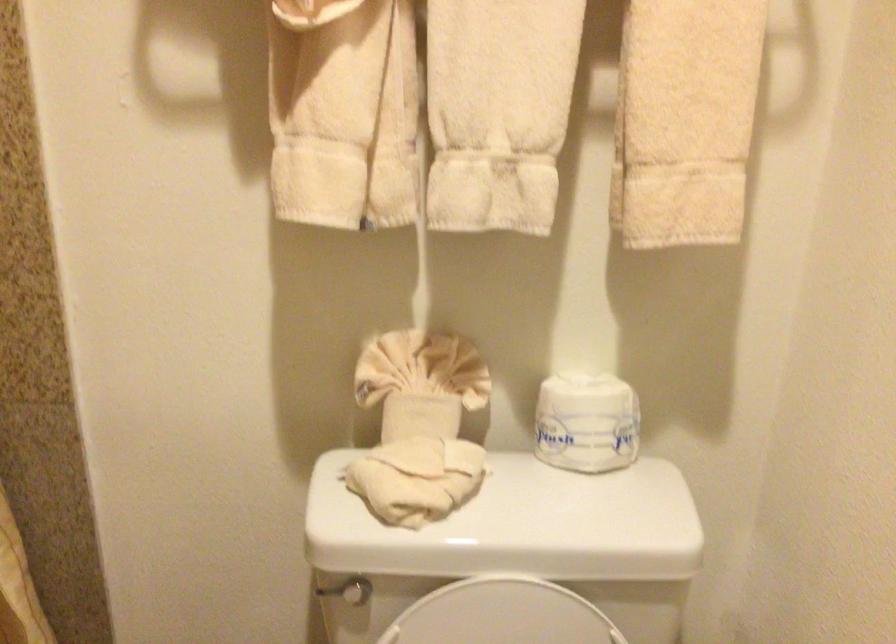
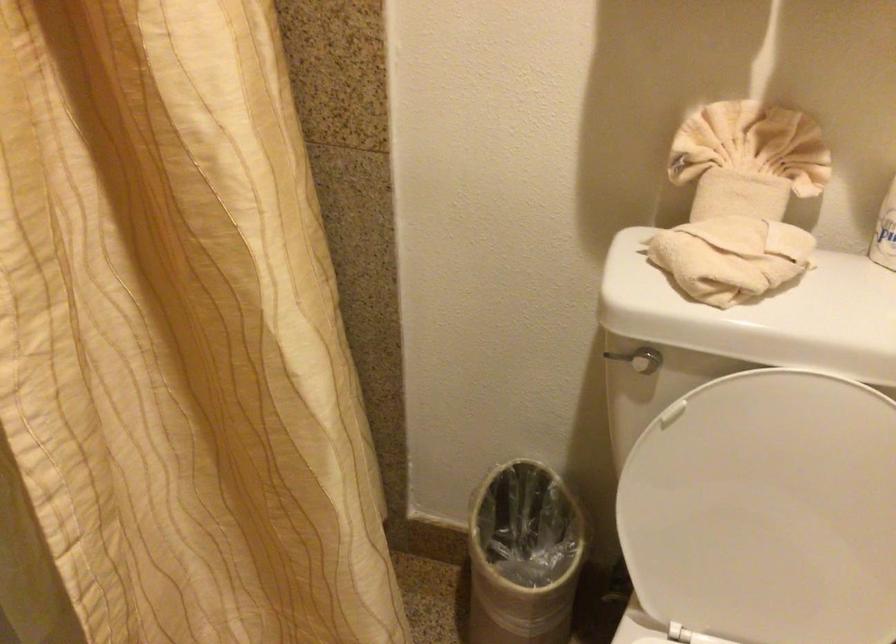
Question: Based on the continuous images, in which direction is the camera rotating? Reply with the corresponding letter.

Choices:
 (A) Left
 (B) Right
 (C) Up
 (D) Down

Answer: (A)